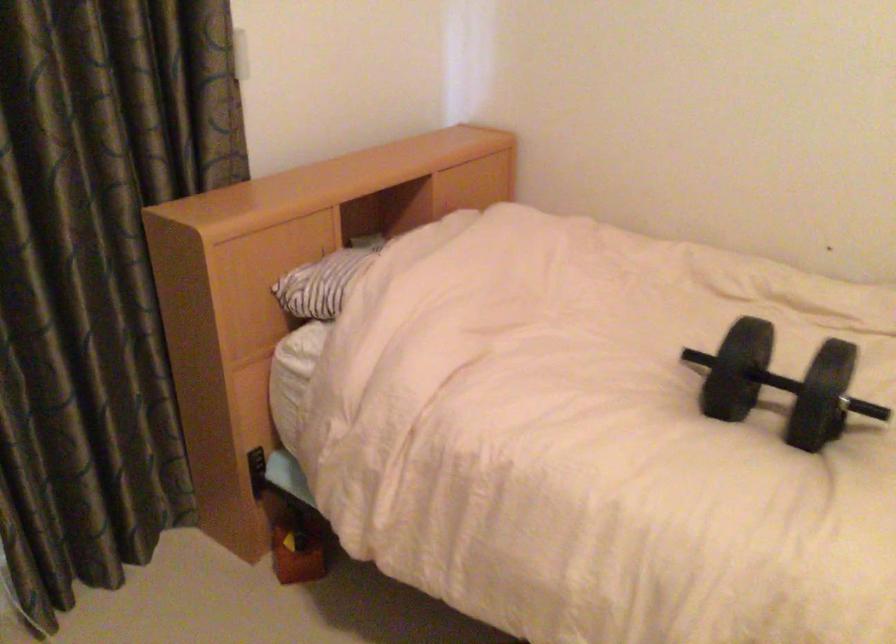
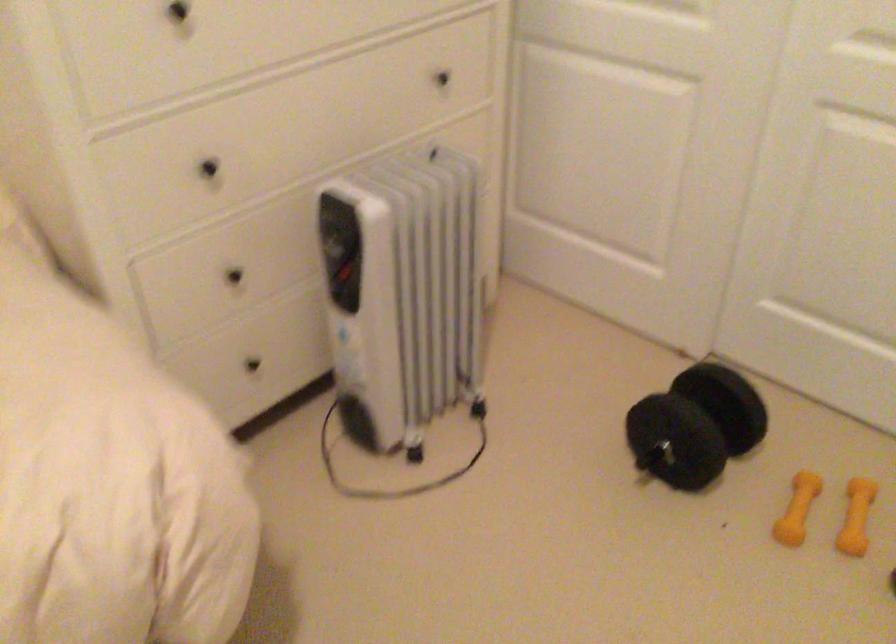
First-person continuous shooting, in which direction is the camera rotating?

The camera's rotation is toward right-down.